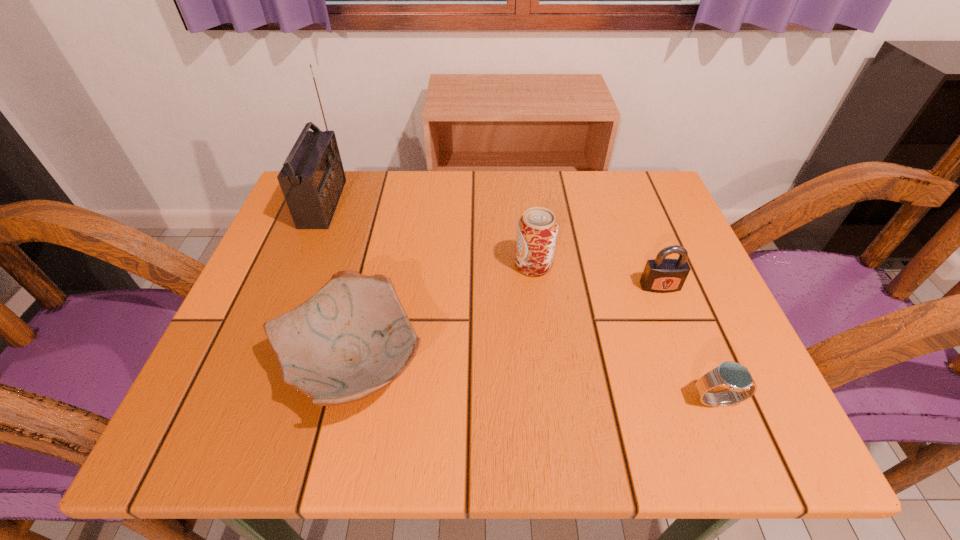
You are a GUI agent. You are given a task and a screenshot of the screen. Output one action in this format:
    pyautogui.click(x=<x>, y=<y>)
    Task: Click on the object that is positioned at the near left corner
    The image size is (960, 540).
    Given the screenshot: What is the action you would take?
    pyautogui.click(x=352, y=338)

Where is `object that is at the near right corner`? object that is at the near right corner is located at coordinates (737, 378).

Where is `free space at the far edge of the desktop`? This screenshot has width=960, height=540. free space at the far edge of the desktop is located at coordinates (584, 229).

Locate an element on the screen. The width and height of the screenshot is (960, 540). free region at the left edge of the desktop is located at coordinates (302, 261).

In the image, there is a desktop. Identify the location of vacant space at the right edge. (644, 331).

In the image, there is a desktop. Identify the location of vacant space at the far right corner. The image size is (960, 540). (597, 175).

Where is `vacant space at the near right corner of the desktop`? This screenshot has width=960, height=540. vacant space at the near right corner of the desktop is located at coordinates (755, 400).

The image size is (960, 540). Identify the location of vacant area that lies between the fourth nearest object and the watch. (625, 333).

The width and height of the screenshot is (960, 540). I want to click on free space between the third nearest object and the fourth nearest object, so click(x=597, y=275).

Image resolution: width=960 pixels, height=540 pixels. In order to click on free spot between the pottery and the shortest object in this screenshot , I will do `click(535, 382)`.